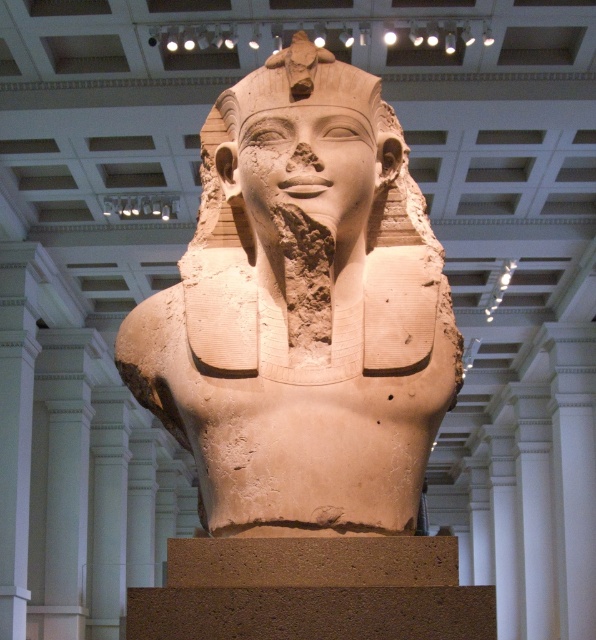
Question: Which point appears closest to the camera in this image?

Choices:
 (A) (240, 80)
 (B) (280, 353)

Answer: (B)

Question: In this image, where is beige stone bust at center located relative to beige stone head at center?

Choices:
 (A) above
 (B) below

Answer: (B)

Question: Does beige stone bust at center appear on the left side of beige stone head at center?

Choices:
 (A) yes
 (B) no

Answer: (A)

Question: Does beige stone bust at center have a smaller size compared to beige stone head at center?

Choices:
 (A) no
 (B) yes

Answer: (A)

Question: Which object is closer to the camera taking this photo?

Choices:
 (A) beige stone bust at center
 (B) beige stone head at center

Answer: (A)

Question: Which of the following is the closest to the observer?

Choices:
 (A) (247, 268)
 (B) (375, 227)

Answer: (A)